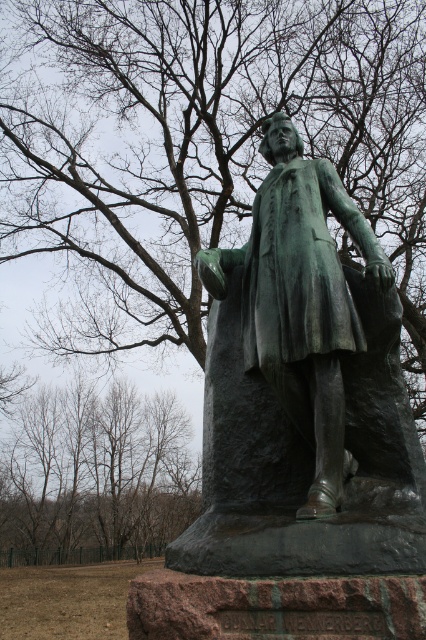
What do you see at coordinates (301, 298) in the screenshot?
I see `green patina statue at center` at bounding box center [301, 298].

Image resolution: width=426 pixels, height=640 pixels. Find the location of `green patina statue at center`. green patina statue at center is located at coordinates (301, 298).

Does point (322, 266) come behind point (43, 483)?

No, (322, 266) is closer to viewer.

The image size is (426, 640). Identify the location of green patina statue at center. (301, 298).